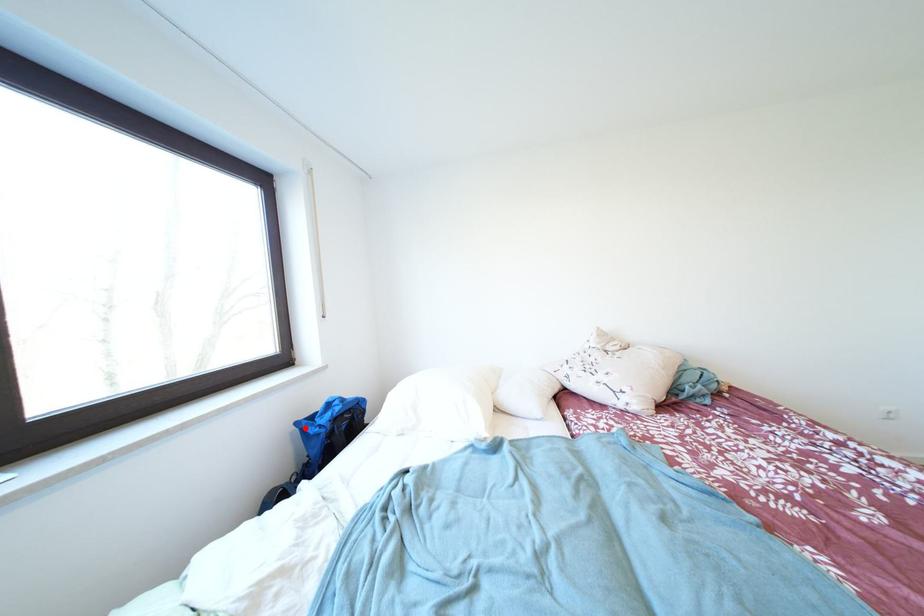
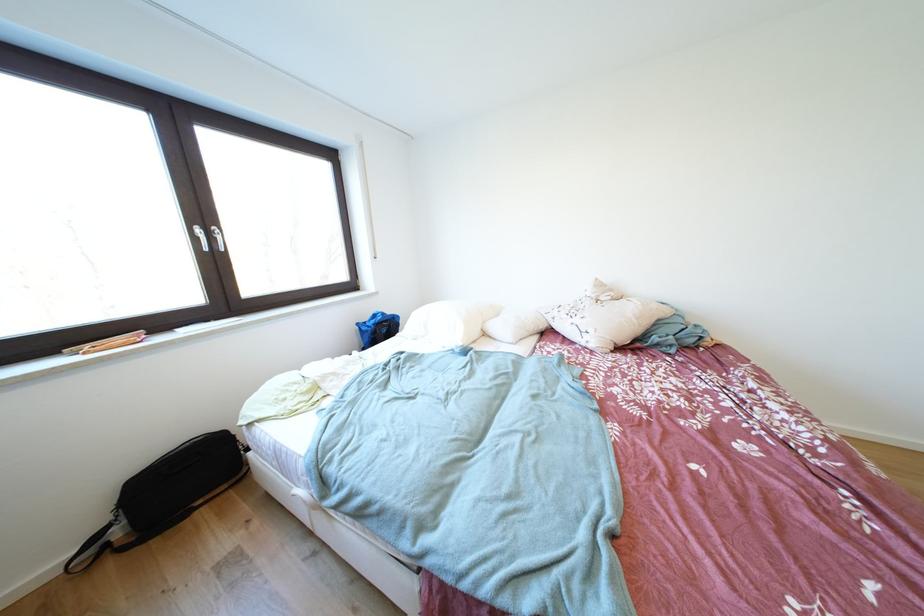
Locate, in the second image, the point that corresponds to the highlighted location in the first image.

(367, 329)